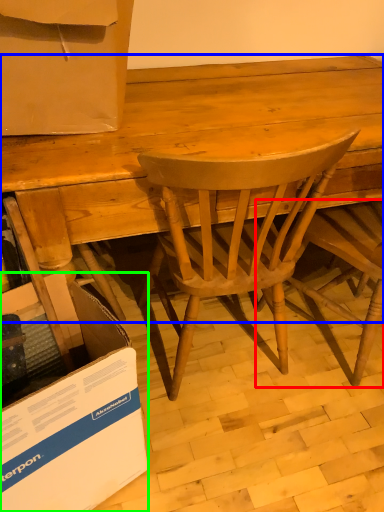
Question: Which object is the closest to the chair (highlighted by a red box)? Choose among these: desk (highlighted by a blue box) or cardboard box (highlighted by a green box).

Choices:
 (A) desk
 (B) cardboard box

Answer: (A)